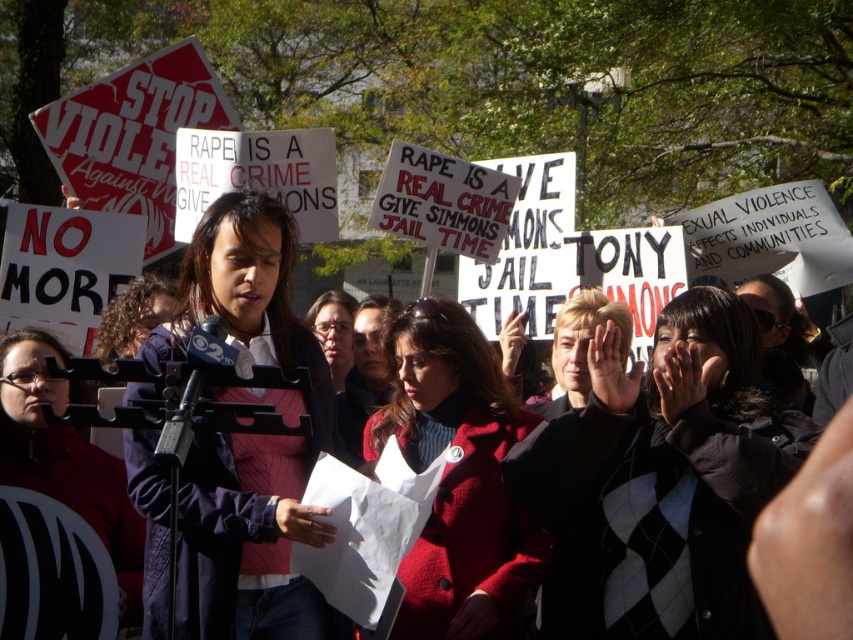
Question: Among these points, which one is nearest to the camera?

Choices:
 (A) (212, 492)
 (B) (409, 364)
 (C) (16, 339)

Answer: (A)

Question: In this image, where is dark blue jacket at center located relative to red wool coat at center?

Choices:
 (A) left
 (B) right

Answer: (A)

Question: Which point is closer to the camera?

Choices:
 (A) black argyle sweater at center
 (B) matte black microphone at center
 (C) red wool coat at center
 (D) dark blue jacket at center

Answer: (D)

Question: Where is dark blue jacket at center located in relation to matte black microphone at center in the image?

Choices:
 (A) below
 (B) above

Answer: (B)

Question: Does red wool coat at center have a larger size compared to matte black microphone at center?

Choices:
 (A) no
 (B) yes

Answer: (A)

Question: Which point is farther to the camera?

Choices:
 (A) (270, 596)
 (B) (805, 422)

Answer: (B)